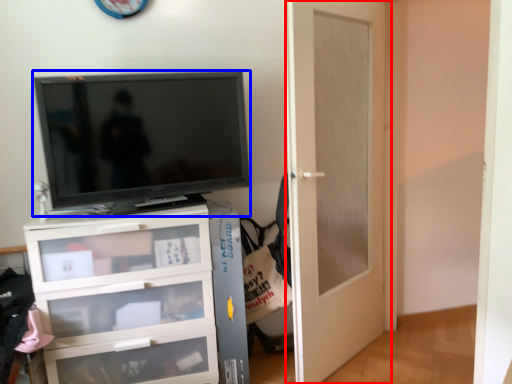
Question: Which object is further to the camera taking this photo, door (highlighted by a red box) or television (highlighted by a blue box)?

Choices:
 (A) door
 (B) television

Answer: (B)